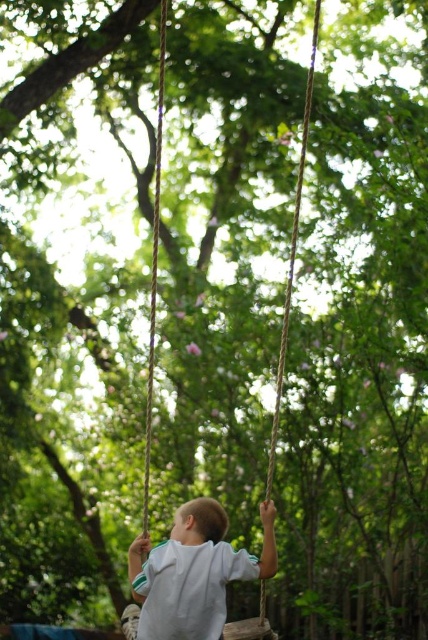
You are a photographer trying to capture the child swinging on the rope swing at center. You notice the white cotton shirt at center in your viewfinder. Where should you position your camera relative to the child to ensure the shirt is not blocking the swing in the photo?

The white cotton shirt at center is below the rope swing at center. To avoid the shirt blocking the swing, position your camera above the child so the shirt is below and out of the way of the swing in the frame.

You are a photographer trying to capture the child in the center of the image. The white cotton shirt at center and the rope swing at center are both in focus. Which object appears bigger in your photo?

The white cotton shirt at center appears larger than the rope swing at center in the photo.